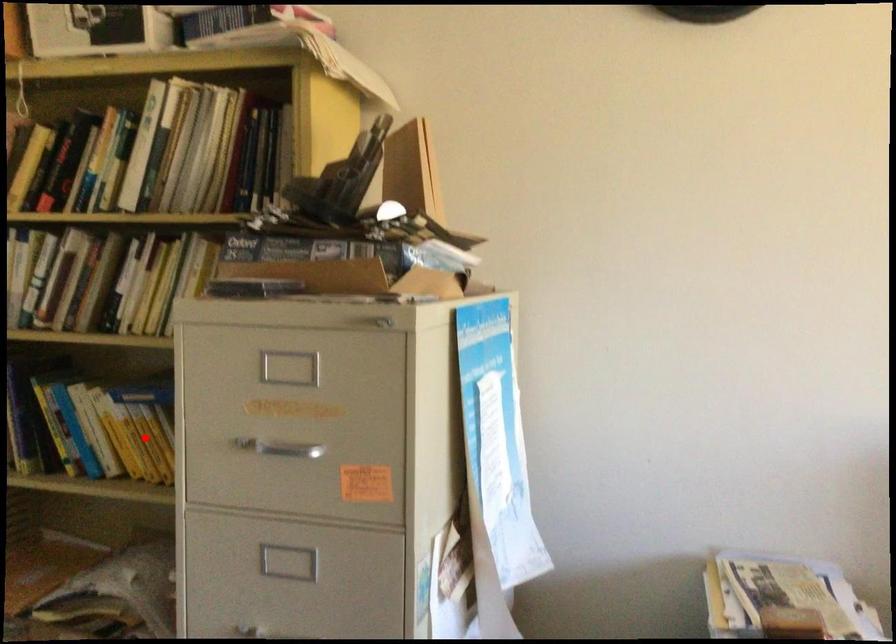
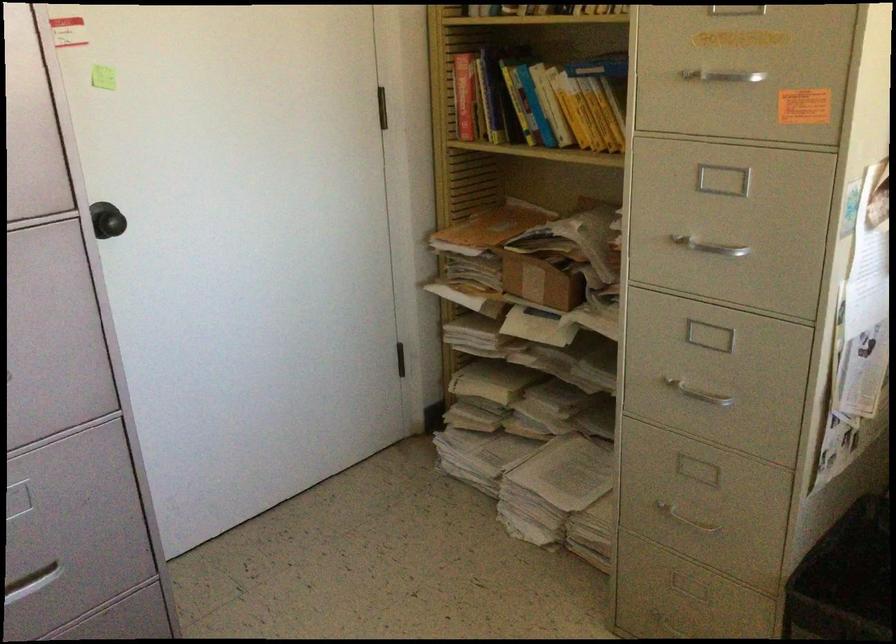
Question: I am providing you with two images of the same scene from different viewpoints. Image1 has a red point marked. In image2, the corresponding 3D location appears at what relative position? Reply with the corresponding letter.

Choices:
 (A) Closer
 (B) Farther

Answer: (B)